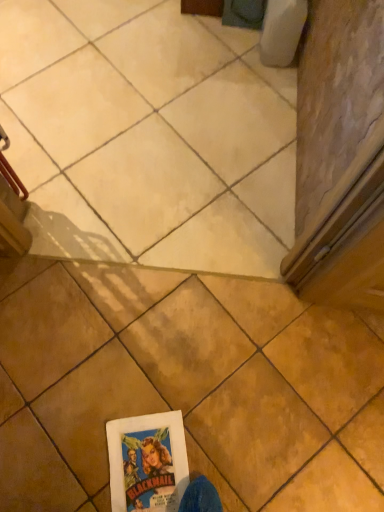
Question: Considering the positions of matte beige tile at center, arranged as the 2th tile when ordered from the bottom, and brown matte tile at center, the 1th tile when ordered from front to back, in the image, is matte beige tile at center, arranged as the 2th tile when ordered from the bottom, bigger or smaller than brown matte tile at center, the 1th tile when ordered from front to back,?

Choices:
 (A) small
 (B) big

Answer: (A)

Question: Based on their positions, is matte beige tile at center, acting as the 1th tile starting from the top, located to the left or right of brown matte tile at center, placed as the 2th tile when sorted from back to front?

Choices:
 (A) left
 (B) right

Answer: (A)

Question: Which is correct: matte beige tile at center, acting as the 1th tile starting from the top, is inside brown matte tile at center, the 1th tile when ordered from front to back, or outside of it?

Choices:
 (A) outside
 (B) inside

Answer: (A)

Question: Do you think brown matte tile at center, which appears as the first tile when ordered from the bottom, is within matte beige tile at center, arranged as the 2th tile when ordered from the bottom, or outside of it?

Choices:
 (A) outside
 (B) inside

Answer: (A)

Question: In terms of width, does brown matte tile at center, the 2th tile in the top-to-bottom sequence, look wider or thinner when compared to matte beige tile at center, acting as the 1th tile starting from the top?

Choices:
 (A) wide
 (B) thin

Answer: (B)

Question: Does point pyautogui.click(x=297, y=472) appear closer or farther from the camera than point pyautogui.click(x=208, y=244)?

Choices:
 (A) closer
 (B) farther

Answer: (A)

Question: Considering their positions, is brown matte tile at center, the 1th tile when ordered from front to back, located in front of or behind matte beige tile at center, acting as the 1th tile starting from the top?

Choices:
 (A) front
 (B) behind

Answer: (A)